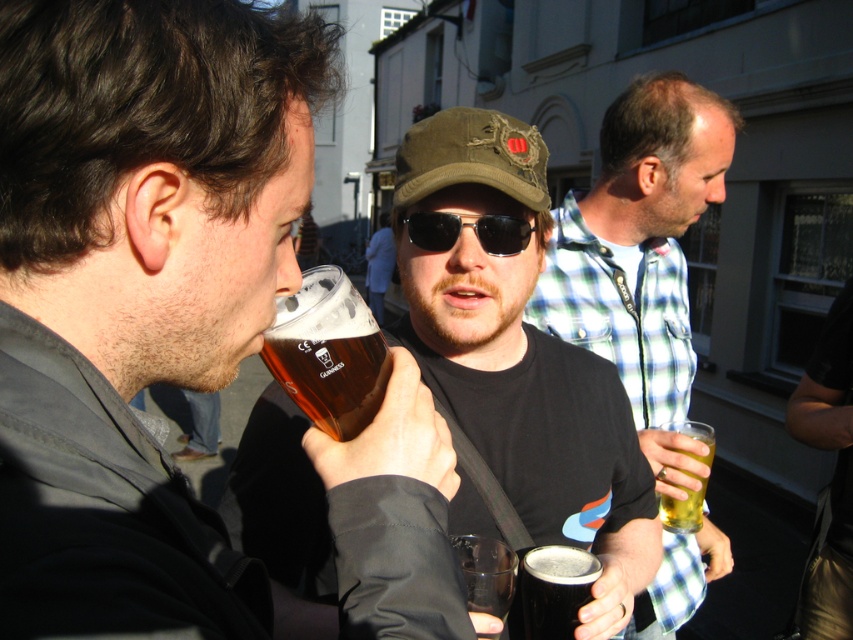
Question: Which object is farther from the camera taking this photo?

Choices:
 (A) sunglasses at center
 (B) translucent glass beer at center
 (C) amber glass at center
 (D) translucent plastic cup at center

Answer: (B)

Question: Is translucent glass mug at center positioned at the back of amber glass at center?

Choices:
 (A) no
 (B) yes

Answer: (B)

Question: Which object is positioned farthest from the amber glass at center?

Choices:
 (A) translucent glass beer at center
 (B) matte black t-shirt at center
 (C) matte glass mug at center
 (D) translucent plastic cup at center

Answer: (B)

Question: Does matte glass mug at center have a lesser width compared to dark matte stout at lower center?

Choices:
 (A) yes
 (B) no

Answer: (B)

Question: Is matte black t-shirt at center thinner than dark matte stout at lower center?

Choices:
 (A) yes
 (B) no

Answer: (B)

Question: Which point is closer to the camera taking this photo?

Choices:
 (A) pyautogui.click(x=697, y=529)
 (B) pyautogui.click(x=505, y=556)
 (C) pyautogui.click(x=639, y=90)

Answer: (B)